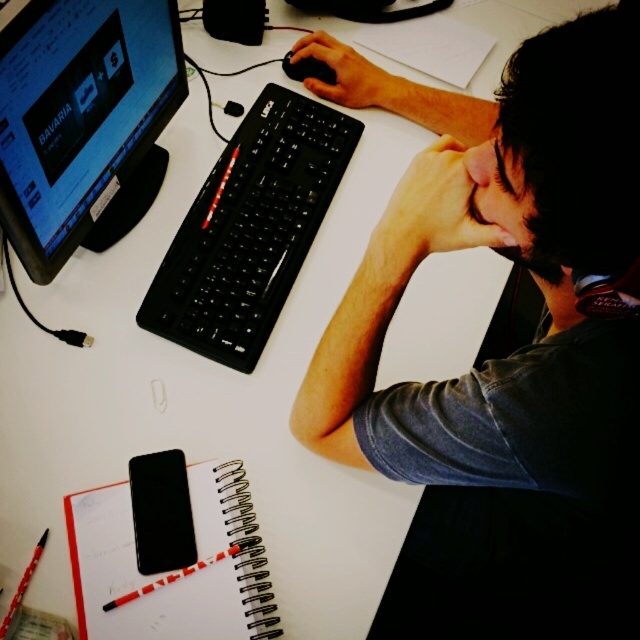
In the scene shown: Does dark gray shirt at upper right have a lesser height compared to red striped pen at lower left?

No, dark gray shirt at upper right is not shorter than red striped pen at lower left.

Does dark gray shirt at upper right appear on the right side of red striped pen at lower left?

Yes, dark gray shirt at upper right is to the right of red striped pen at lower left.

Is point (563, 65) farther from viewer compared to point (36, 561)?

No, (563, 65) is in front of (36, 561).

Find the location of a particular element. This screenshot has height=640, width=640. dark gray shirt at upper right is located at coordinates (509, 355).

Can you confirm if dark brown hair at upper right is bigger than black matte mouse at center?

Indeed, dark brown hair at upper right has a larger size compared to black matte mouse at center.

Is point (513, 211) more distant than point (300, 61)?

That is False.

Where is `dark brown hair at upper right`? dark brown hair at upper right is located at coordinates (577, 147).

Does spiral-bound notebook at lower left lie behind black matte mouse at center?

No, spiral-bound notebook at lower left is closer to the viewer.

Is spiral-bound notebook at lower left taller than black matte mouse at center?

Yes, spiral-bound notebook at lower left is taller than black matte mouse at center.

This screenshot has width=640, height=640. What do you see at coordinates (172, 570) in the screenshot?
I see `spiral-bound notebook at lower left` at bounding box center [172, 570].

Locate an element on the screen. The height and width of the screenshot is (640, 640). spiral-bound notebook at lower left is located at coordinates (172, 570).